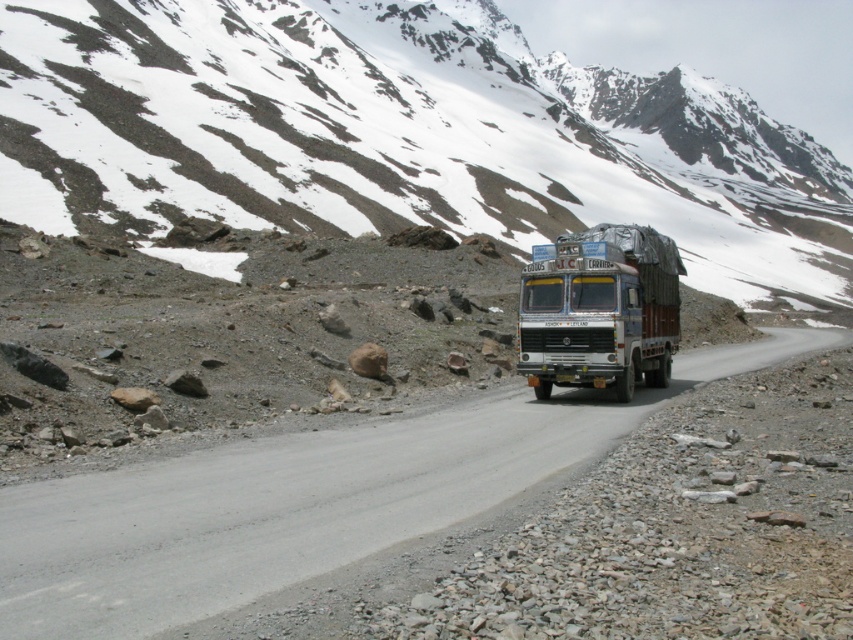
Question: Which point is closer to the camera?

Choices:
 (A) (299, 452)
 (B) (616, 369)

Answer: (A)

Question: Which point appears closest to the camera in this image?

Choices:
 (A) (630, 378)
 (B) (235, 464)

Answer: (B)

Question: Does gray asphalt road at center have a greater width compared to metallic blue trailer truck at center?

Choices:
 (A) yes
 (B) no

Answer: (A)

Question: Where is snowy rock at upper center located in relation to gray asphalt road at center in the image?

Choices:
 (A) right
 (B) left

Answer: (A)

Question: Estimate the real-world distances between objects in this image. Which object is closer to the gray asphalt road at center?

Choices:
 (A) metallic blue trailer truck at center
 (B) snowy rock at upper center

Answer: (A)

Question: Is snowy rock at upper center below gray asphalt road at center?

Choices:
 (A) yes
 (B) no

Answer: (B)